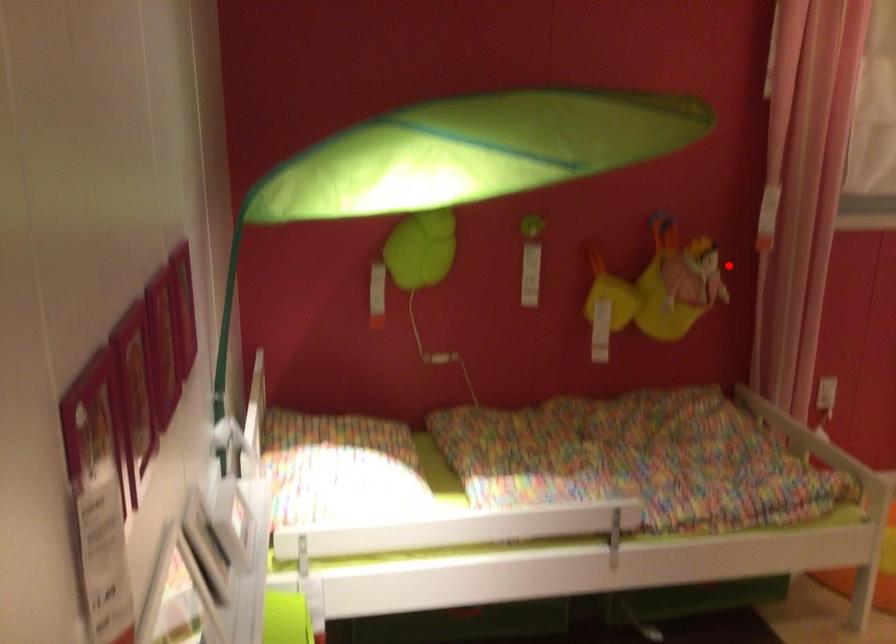
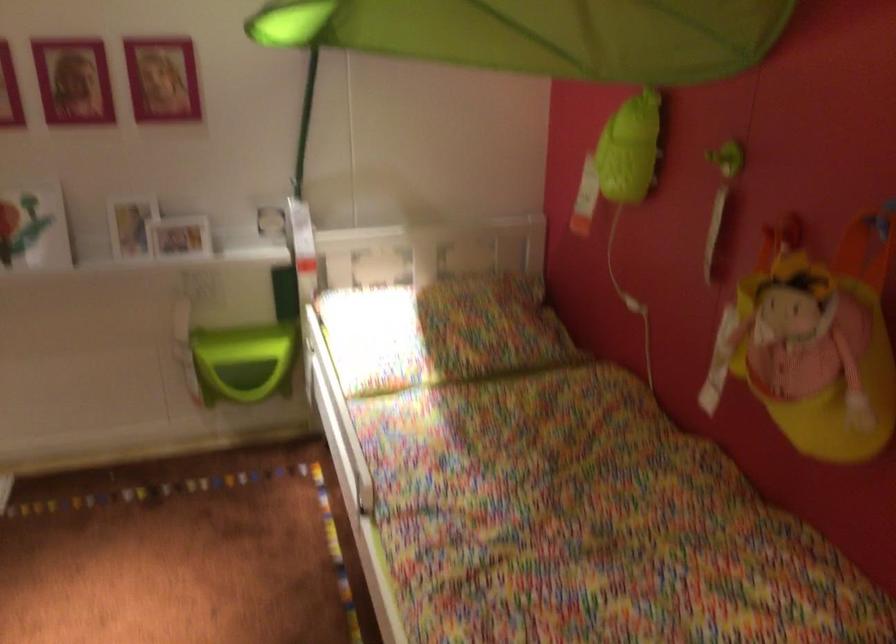
Question: I am providing you with two images of the same scene from different viewpoints. In image1, a red point is highlighted. Considering the same 3D point in image2, which of the following is correct?

Choices:
 (A) It is closer
 (B) It is farther

Answer: (A)